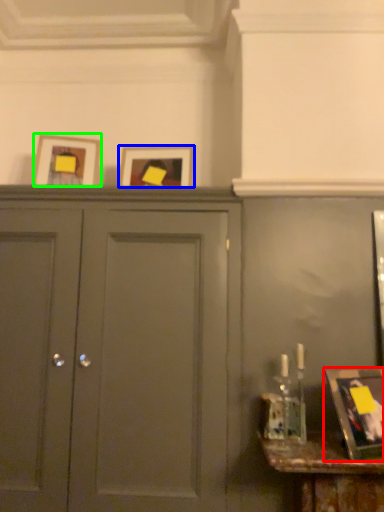
Question: Considering the real-world distances, which object is closest to picture frame (highlighted by a red box)? picture frame (highlighted by a blue box) or picture frame (highlighted by a green box).

Choices:
 (A) picture frame
 (B) picture frame

Answer: (A)